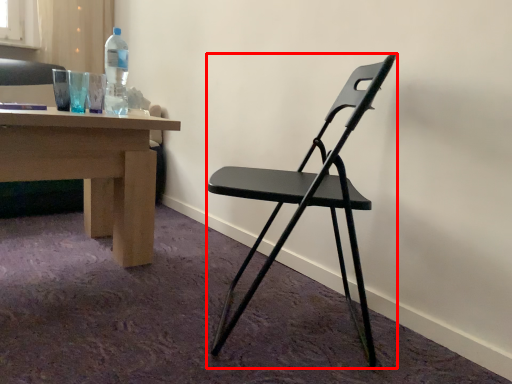
Question: Where is chair (annotated by the red box) located in relation to bottle in the image?

Choices:
 (A) left
 (B) right

Answer: (B)